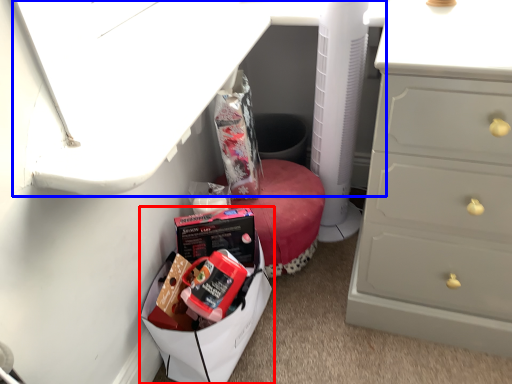
Question: Which object is further to the camera taking this photo, lunch box (highlighted by a red box) or vanity (highlighted by a blue box)?

Choices:
 (A) lunch box
 (B) vanity

Answer: (A)